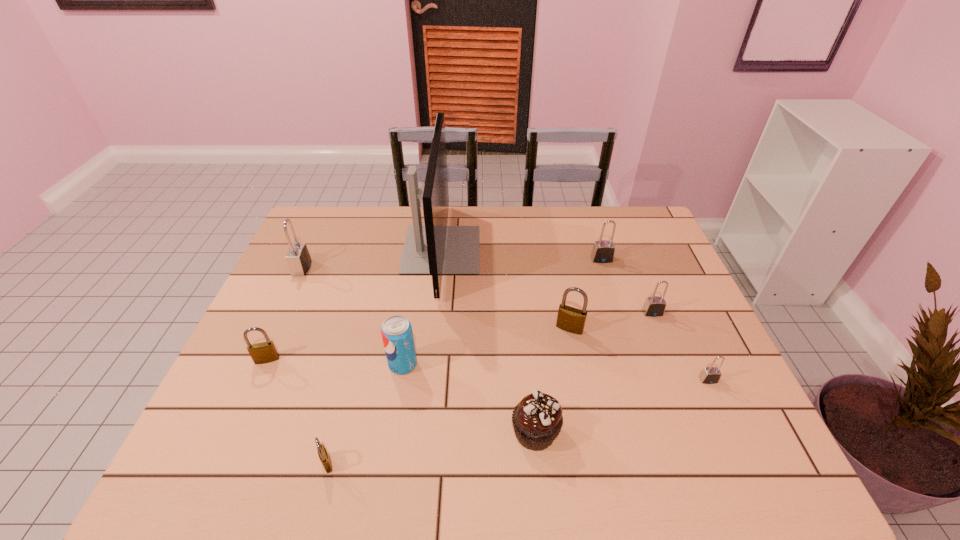
Find the location of a particular element. This screenshot has height=540, width=960. padlock situated at the near edge is located at coordinates (322, 453).

Find the location of a particular element. free space at the far edge of the desktop is located at coordinates (353, 224).

Where is `vacant area at the near edge of the desktop`? This screenshot has width=960, height=540. vacant area at the near edge of the desktop is located at coordinates (598, 443).

In the image, there is a desktop. Where is `vacant region at the left edge`? vacant region at the left edge is located at coordinates (294, 285).

This screenshot has height=540, width=960. Identify the location of vacant space at the right edge. (716, 442).

Identify the location of vacant region at the near left corner of the desktop. The height and width of the screenshot is (540, 960). (193, 474).

Image resolution: width=960 pixels, height=540 pixels. In the image, there is a desktop. In order to click on free space at the far right corner in this screenshot , I will do `click(643, 218)`.

At what (x,y) coordinates should I click in order to perform the action: click on free space between the biggest gray padlock and the computer monitor. Please return your answer as a coordinate pair (x, y). Image resolution: width=960 pixels, height=540 pixels. Looking at the image, I should click on (372, 259).

Image resolution: width=960 pixels, height=540 pixels. I want to click on free space between the leftmost brass padlock and the tallest padlock, so tap(284, 314).

You are a GUI agent. You are given a task and a screenshot of the screen. Output one action in this format:
    pyautogui.click(x=<x>, y=<y>)
    Task: Click on the vacant area that lies between the third object from right to left and the soda can
    This screenshot has height=540, width=960.
    Given the screenshot: What is the action you would take?
    pyautogui.click(x=502, y=312)